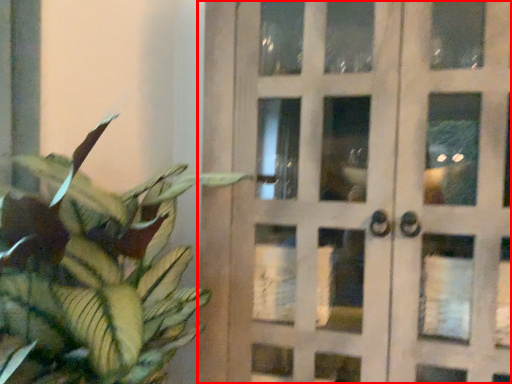
Question: From the image's perspective, where is door (annotated by the red box) located relative to houseplant?

Choices:
 (A) below
 (B) above

Answer: (B)